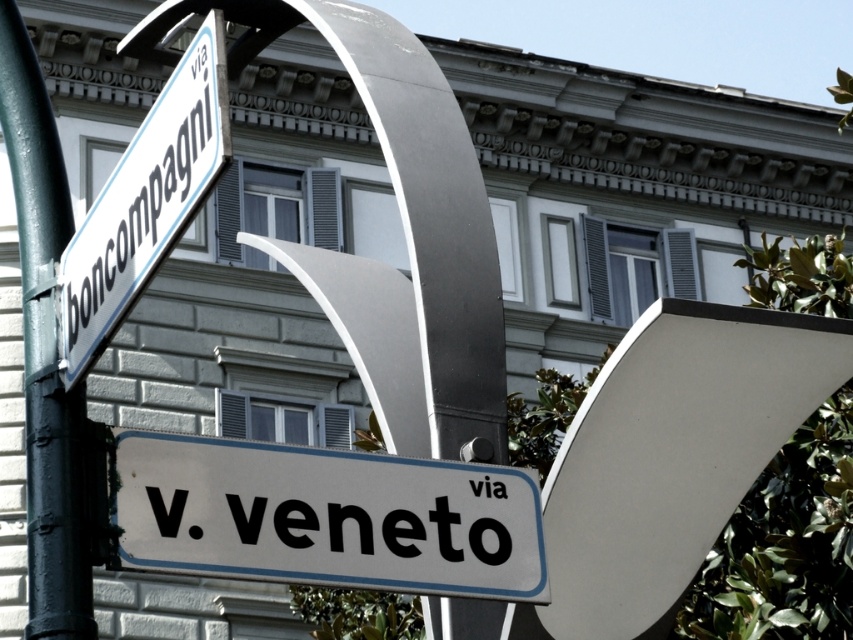
Question: Considering the relative positions of white plastic street sign at center and white plastic street sign at upper left in the image provided, where is white plastic street sign at center located with respect to white plastic street sign at upper left?

Choices:
 (A) right
 (B) left

Answer: (A)

Question: Which point appears farthest from the camera in this image?

Choices:
 (A) (20, 65)
 (B) (193, 90)

Answer: (A)

Question: Which point appears closest to the camera in this image?

Choices:
 (A) (294, 476)
 (B) (96, 304)
 (C) (53, 588)

Answer: (C)

Question: Which object is closer to the camera taking this photo?

Choices:
 (A) white plastic street sign at center
 (B) white plastic street sign at upper left
 (C) green painted metal pole at left

Answer: (B)

Question: Does white plastic street sign at center appear on the left side of green painted metal pole at left?

Choices:
 (A) yes
 (B) no

Answer: (B)

Question: Is green painted metal pole at left smaller than white plastic street sign at upper left?

Choices:
 (A) yes
 (B) no

Answer: (B)